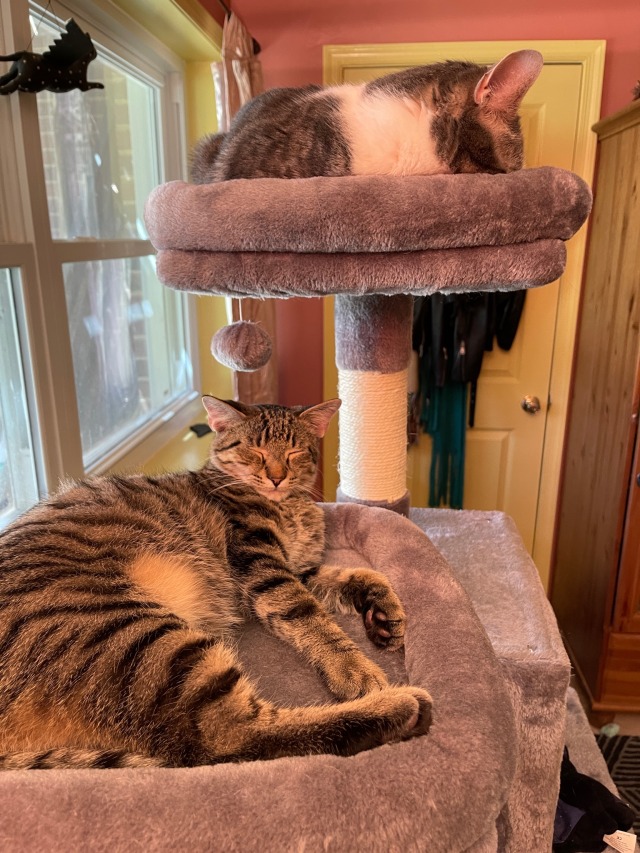
Image resolution: width=640 pixels, height=853 pixels. In order to click on window sill in this screenshot , I will do `click(180, 459)`.